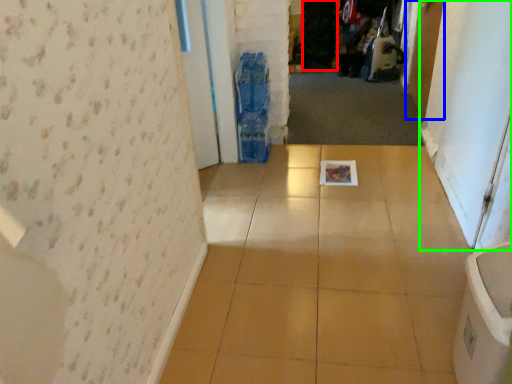
Question: Based on their relative distances, which object is nearer to screen door (highlighted by a red box)? Choose from door (highlighted by a blue box) and screen door (highlighted by a green box).

Choices:
 (A) door
 (B) screen door

Answer: (A)